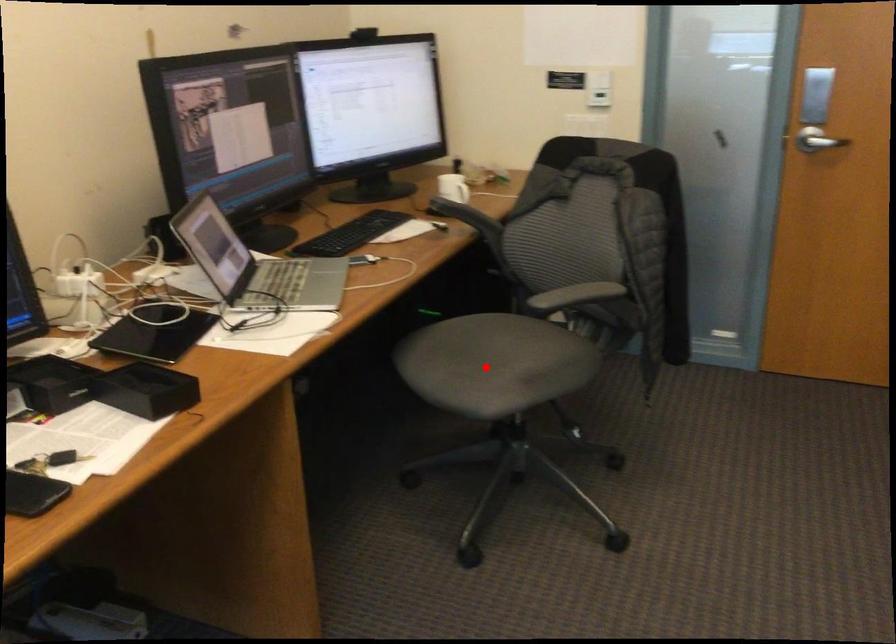
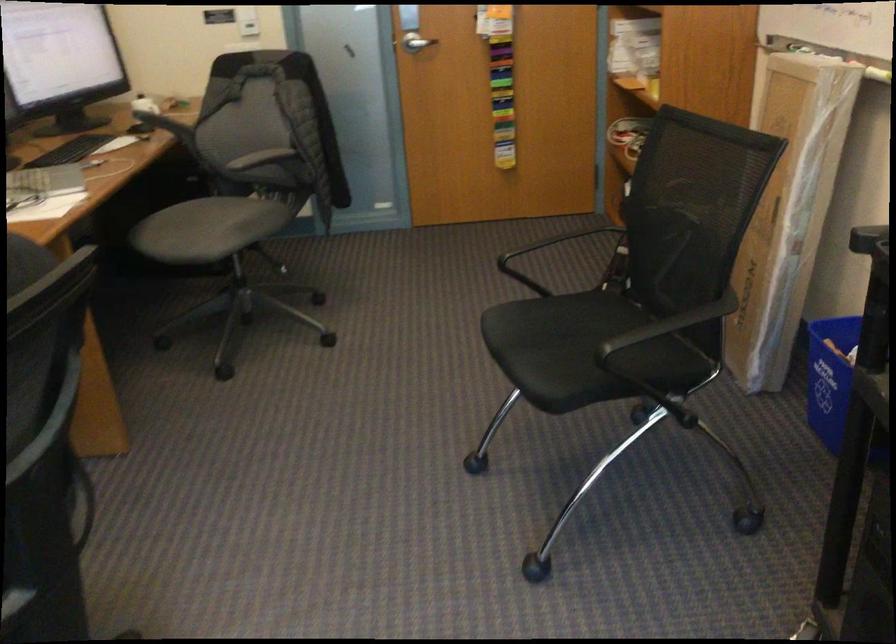
Where in the second image is the point corresponding to the highlighted location from the first image?

(207, 229)